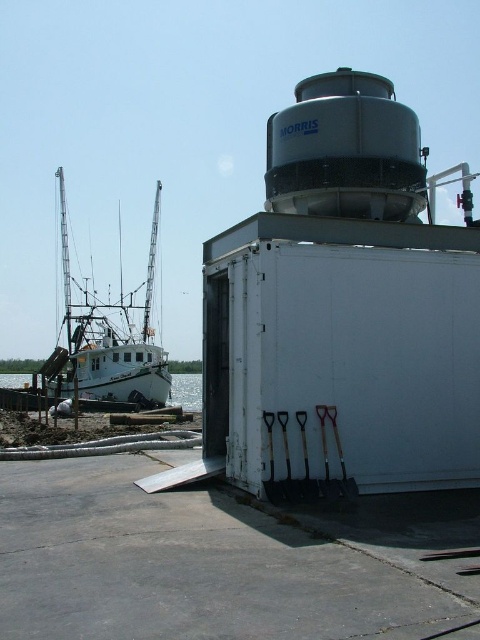
Does white matte boat at left have a larger size compared to white glossy water at lower left?

Yes, white matte boat at left is bigger than white glossy water at lower left.

Does point (64, 253) lie behind point (182, 385)?

No, it is not.

This screenshot has height=640, width=480. I want to click on white matte boat at left, so click(x=107, y=340).